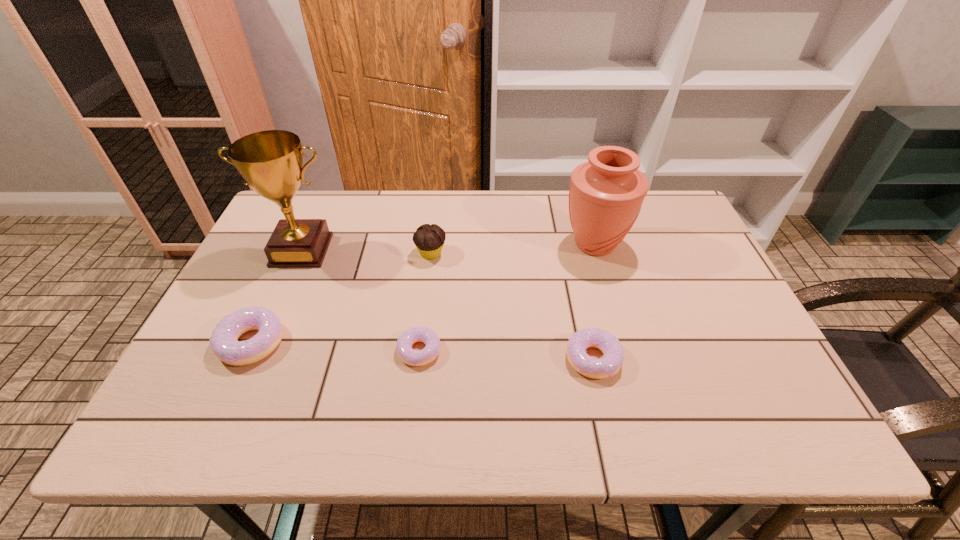
Locate an element on the screen. The height and width of the screenshot is (540, 960). free location located on the right of the second doughnut from left to right is located at coordinates (486, 350).

You are a GUI agent. You are given a task and a screenshot of the screen. Output one action in this format:
    pyautogui.click(x=<x>, y=<y>)
    Task: Click on the free space located on the left of the rightmost doughnut
    
    Given the screenshot: What is the action you would take?
    pyautogui.click(x=521, y=359)

At what (x,y) coordinates should I click in order to perform the action: click on vacant space located on the left of the vase. Please return your answer as a coordinate pair (x, y). Looking at the image, I should click on (437, 245).

Find the location of a particular element. vacant area situated 0.240m on the plaque of the award is located at coordinates (262, 340).

The height and width of the screenshot is (540, 960). What are the coordinates of `vacant area situated on the back of the muffin` in the screenshot? It's located at (435, 224).

The width and height of the screenshot is (960, 540). Identify the location of vase that is at the far edge. (606, 193).

Where is `award that is positioned at the far edge`? award that is positioned at the far edge is located at coordinates (270, 161).

Identify the location of doughnut located at the left edge. (224, 342).

Where is `award located at the left edge`? Image resolution: width=960 pixels, height=540 pixels. award located at the left edge is located at coordinates (270, 161).

Find the location of a particular element. object located at the far left corner is located at coordinates (270, 161).